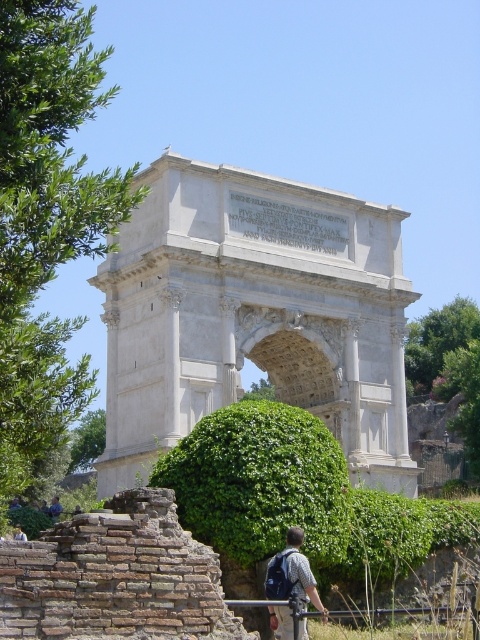
Can you confirm if gray fabric backpack at lower center is positioned below light brown leather jacket at lower center?

Actually, gray fabric backpack at lower center is above light brown leather jacket at lower center.

Can you confirm if gray fabric backpack at lower center is wider than light brown leather jacket at lower center?

Correct, the width of gray fabric backpack at lower center exceeds that of light brown leather jacket at lower center.

Is point (294, 573) more distant than point (14, 531)?

No, it is in front of (14, 531).

The width and height of the screenshot is (480, 640). In order to click on gray fabric backpack at lower center in this screenshot , I will do `click(292, 573)`.

Is white stone arch at center thinner than blue denim jeans at lower center?

Incorrect, white stone arch at center's width is not less than blue denim jeans at lower center's.

Can you confirm if white stone arch at center is positioned to the right of blue denim jeans at lower center?

Indeed, white stone arch at center is positioned on the right side of blue denim jeans at lower center.

Which is behind, point (112, 364) or point (48, 508)?

Positioned behind is point (48, 508).

Identify the location of white stone arch at center. (254, 316).

In order to click on white stone arch at center in this screenshot , I will do `click(254, 316)`.

Can you confirm if white stone arch at center is taller than light brown leather jacket at lower center?

Correct, white stone arch at center is much taller as light brown leather jacket at lower center.

Where is `white stone arch at center`? This screenshot has width=480, height=640. white stone arch at center is located at coordinates (254, 316).

At what (x,y) coordinates should I click in order to perform the action: click on white stone arch at center. Please return your answer as a coordinate pair (x, y). This screenshot has width=480, height=640. Looking at the image, I should click on (254, 316).